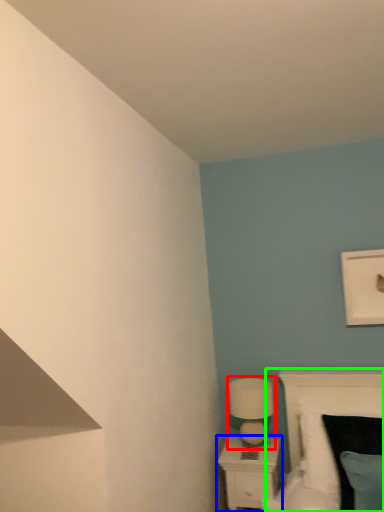
Question: Which object is the farthest from table lamp (highlighted by a red box)? Choose among these: nightstand (highlighted by a blue box) or bed (highlighted by a green box).

Choices:
 (A) nightstand
 (B) bed

Answer: (B)